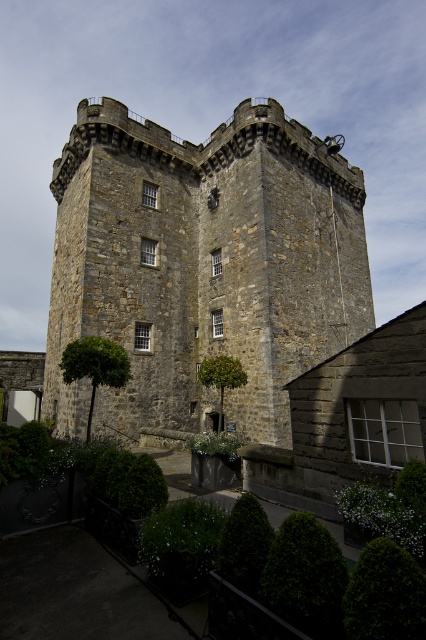
Question: Which of these objects is positioned farthest from the green leafy tree at center?

Choices:
 (A) rustic stone castle at center
 (B) green leafy tree at lower left

Answer: (A)

Question: Does rustic stone castle at center appear under green leafy tree at lower left?

Choices:
 (A) no
 (B) yes

Answer: (A)

Question: From the image, what is the correct spatial relationship of rustic stone castle at center in relation to green leafy tree at center?

Choices:
 (A) left
 (B) right

Answer: (A)

Question: Which object appears closest to the camera in this image?

Choices:
 (A) rustic stone castle at center
 (B) green leafy tree at center

Answer: (A)

Question: Can you confirm if green leafy tree at lower left is positioned above green leafy tree at center?

Choices:
 (A) no
 (B) yes

Answer: (B)

Question: Which point is farther to the camera?

Choices:
 (A) green leafy tree at center
 (B) green leafy tree at lower left

Answer: (A)